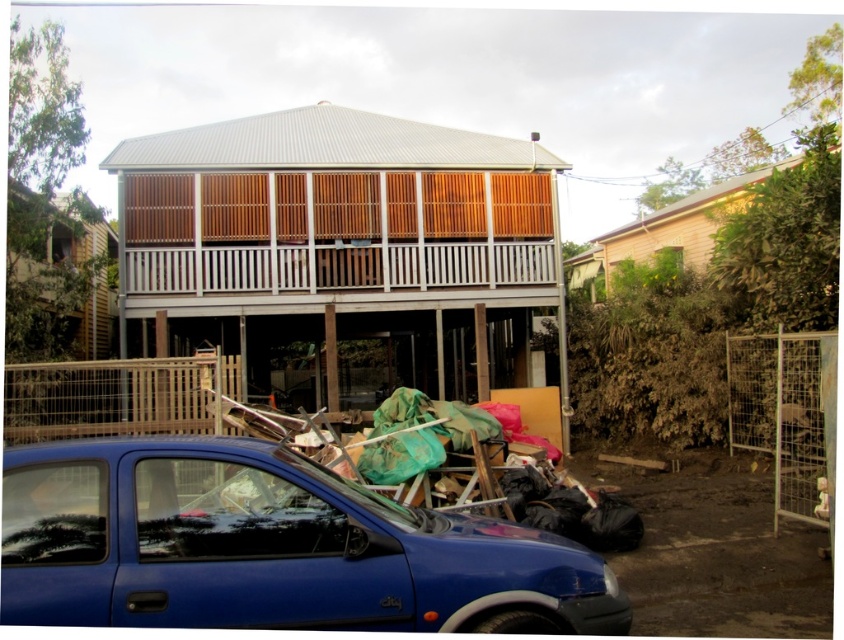
Question: Can you confirm if blue matte car at lower left is positioned to the right of green fabric at lower center?

Choices:
 (A) yes
 (B) no

Answer: (B)

Question: Is blue matte car at lower left positioned behind green fabric at lower center?

Choices:
 (A) yes
 (B) no

Answer: (B)

Question: Which object is farther from the camera taking this photo?

Choices:
 (A) green fabric at lower center
 (B) blue matte car at lower left

Answer: (A)

Question: Which point is closer to the camera?

Choices:
 (A) (201, 449)
 (B) (529, 509)

Answer: (A)

Question: Which point is closer to the camera taking this photo?

Choices:
 (A) (323, 432)
 (B) (230, 609)

Answer: (B)

Question: Is blue matte car at lower left to the left of green fabric at lower center from the viewer's perspective?

Choices:
 (A) yes
 (B) no

Answer: (A)